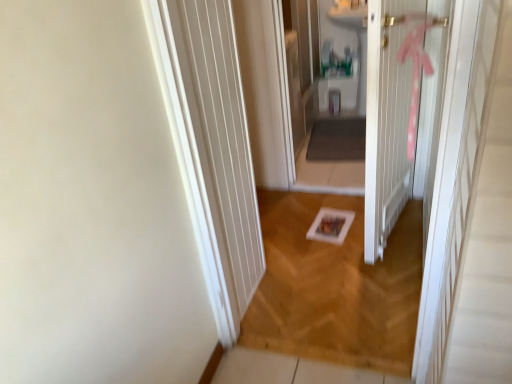
Question: Is wooden frame at center closer to the viewer compared to white wooden door at center?

Choices:
 (A) no
 (B) yes

Answer: (A)

Question: Is wooden frame at center not close to white wooden door at center?

Choices:
 (A) no
 (B) yes

Answer: (A)

Question: Is wooden frame at center facing towards white wooden door at center?

Choices:
 (A) no
 (B) yes

Answer: (A)

Question: Is wooden frame at center positioned with its back to white wooden door at center?

Choices:
 (A) yes
 (B) no

Answer: (B)

Question: Does wooden frame at center have a greater width compared to white wooden door at center?

Choices:
 (A) yes
 (B) no

Answer: (A)

Question: From the image's perspective, is wooden frame at center beneath white wooden door at center?

Choices:
 (A) yes
 (B) no

Answer: (A)

Question: Is matte white sink at center surrounded by white wooden door at center?

Choices:
 (A) yes
 (B) no

Answer: (B)

Question: Is white wooden door at center smaller than matte white sink at center?

Choices:
 (A) no
 (B) yes

Answer: (A)

Question: Is white wooden door at center not inside matte white sink at center?

Choices:
 (A) yes
 (B) no

Answer: (A)

Question: From the image's perspective, does white wooden door at center appear lower than matte white sink at center?

Choices:
 (A) yes
 (B) no

Answer: (A)

Question: Can you confirm if white wooden door at center is shorter than matte white sink at center?

Choices:
 (A) no
 (B) yes

Answer: (A)

Question: Does white wooden door at center lie behind matte white sink at center?

Choices:
 (A) yes
 (B) no

Answer: (B)

Question: Does matte white sink at center lie behind wooden frame at center?

Choices:
 (A) yes
 (B) no

Answer: (A)